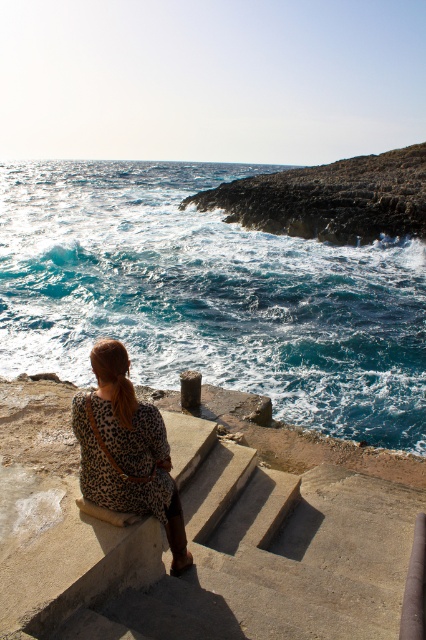
You are a photographer trying to capture the leopard print dress at center and the concrete ledge at lower left in the same frame. Which object should you focus on first if you want to ensure both are in focus, considering their sizes?

The concrete ledge at lower left is bigger than the leopard print dress at center, so focusing on the concrete ledge at lower left first would help ensure both are in focus since larger objects often require more precise focus adjustments.

You are a photographer planning to capture the scene from the same vantage point. Given that the blue water at center and leopard print dress at center are both in your frame, which one appears larger in the photo?

The blue water at center appears larger in the photo because it is taller than the leopard print dress at center.